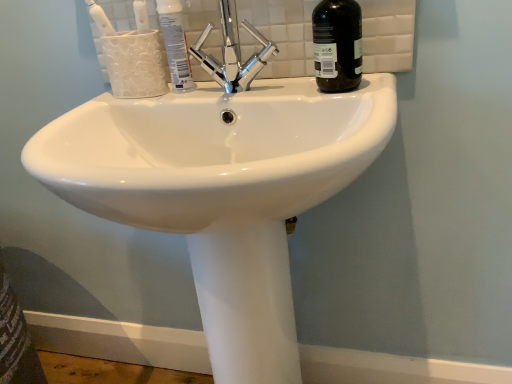
Question: Can you confirm if black glass bottle at upper right is thinner than white glossy toothpaste at upper center?

Choices:
 (A) no
 (B) yes

Answer: (A)

Question: Is black glass bottle at upper right not near white glossy toothpaste at upper center?

Choices:
 (A) no
 (B) yes

Answer: (A)

Question: Is black glass bottle at upper right directly adjacent to white glossy toothpaste at upper center?

Choices:
 (A) yes
 (B) no

Answer: (B)

Question: Can you confirm if black glass bottle at upper right is smaller than white glossy toothpaste at upper center?

Choices:
 (A) no
 (B) yes

Answer: (A)

Question: Would you say black glass bottle at upper right contains white glossy toothpaste at upper center?

Choices:
 (A) no
 (B) yes

Answer: (A)

Question: From the image's perspective, does black glass bottle at upper right appear higher than white glossy toothpaste at upper center?

Choices:
 (A) no
 (B) yes

Answer: (A)

Question: Is white glossy sink at center aimed at polished chrome faucet at upper center?

Choices:
 (A) yes
 (B) no

Answer: (B)

Question: Is white glossy sink at center wider than polished chrome faucet at upper center?

Choices:
 (A) no
 (B) yes

Answer: (B)

Question: Is white glossy sink at center located outside polished chrome faucet at upper center?

Choices:
 (A) yes
 (B) no

Answer: (A)

Question: Does white glossy sink at center have a lesser width compared to polished chrome faucet at upper center?

Choices:
 (A) yes
 (B) no

Answer: (B)

Question: From a real-world perspective, is white glossy sink at center located higher than polished chrome faucet at upper center?

Choices:
 (A) no
 (B) yes

Answer: (A)

Question: Does white glossy sink at center appear on the left side of polished chrome faucet at upper center?

Choices:
 (A) yes
 (B) no

Answer: (B)

Question: Can you confirm if white glossy toothbrush at upper left is shorter than white glossy toothpaste at upper center?

Choices:
 (A) yes
 (B) no

Answer: (B)